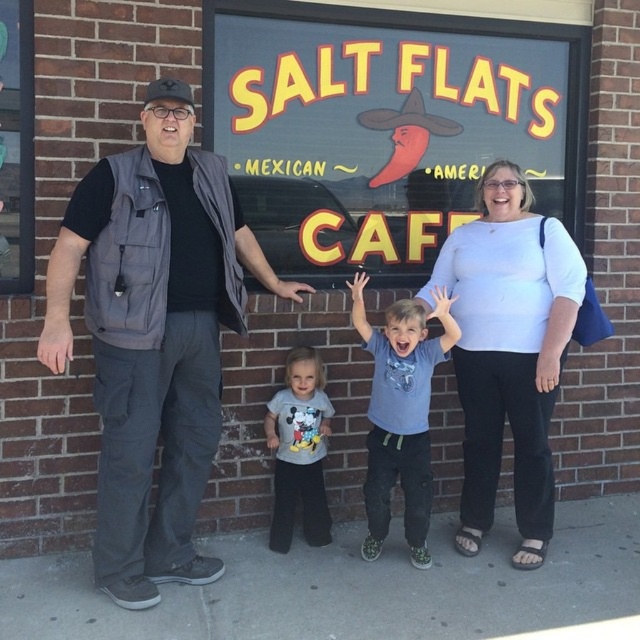
Is gray vest at left positioned at the back of gray cotton shirt at center?

No.

Looking at this image, who is higher up, gray vest at left or gray cotton shirt at center?

gray vest at left is higher up.

Is point (100, 465) positioned after point (273, 522)?

No, (100, 465) is closer to viewer.

At what (x,y) coordinates should I click in order to perform the action: click on gray vest at left. Please return your answer as a coordinate pair (x, y). The image size is (640, 640). Looking at the image, I should click on (154, 337).

Is the position of white cotton shirt at center less distant than that of blue cotton shirt at center?

No, it is not.

Does white cotton shirt at center appear under blue cotton shirt at center?

No.

Image resolution: width=640 pixels, height=640 pixels. What are the coordinates of `white cotton shirt at center` in the screenshot? It's located at (508, 352).

In order to click on white cotton shirt at center in this screenshot , I will do `click(508, 352)`.

In the scene shown: How much distance is there between yellow painted sign at center and blue cotton shirt at center?

A distance of 30.49 inches exists between yellow painted sign at center and blue cotton shirt at center.

Measure the distance between yellow painted sign at center and camera.

A distance of 10.84 feet exists between yellow painted sign at center and camera.

Image resolution: width=640 pixels, height=640 pixels. Find the location of `yellow painted sign at center`. yellow painted sign at center is located at coordinates (385, 125).